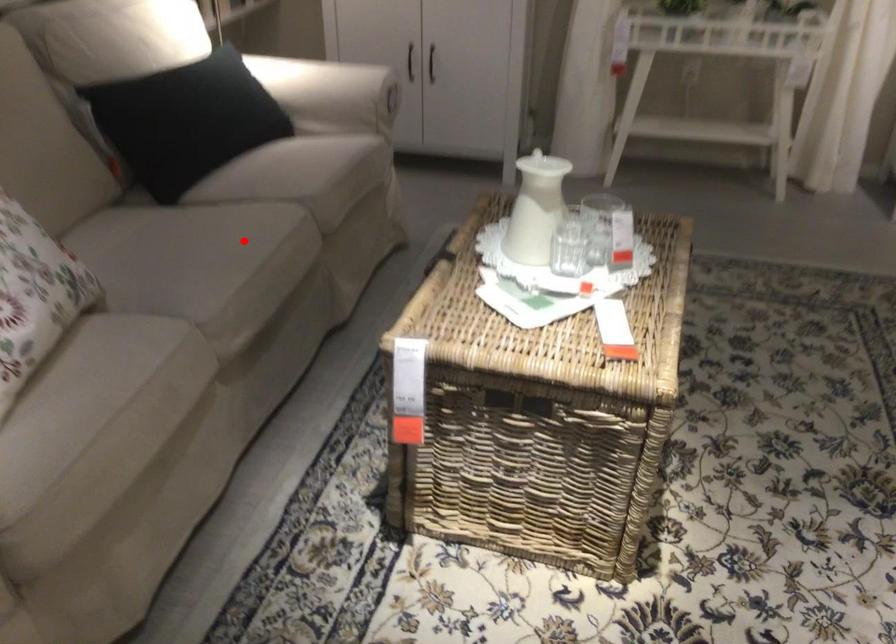
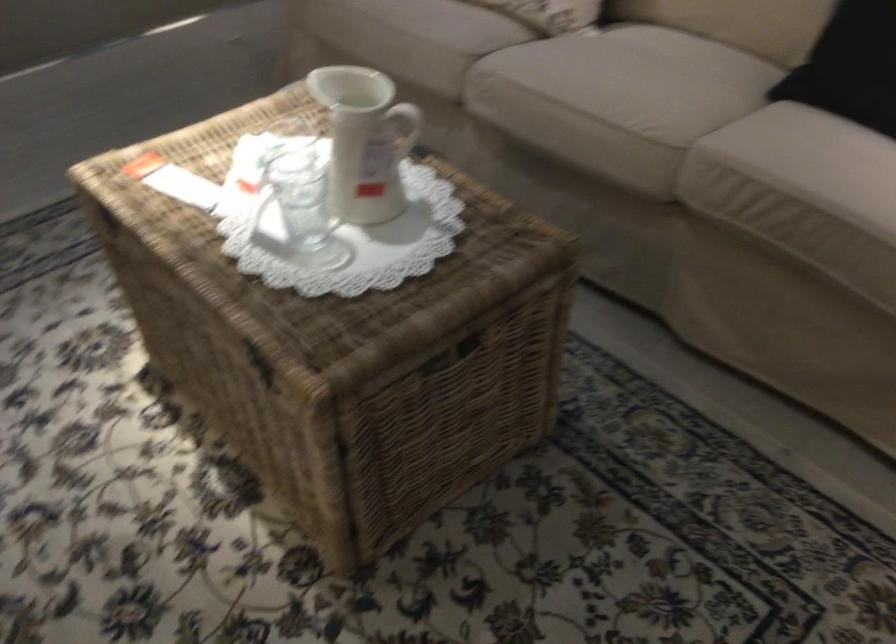
Question: I am providing you with two images of the same scene from different viewpoints. Image1 has a red point marked. In image2, the corresponding 3D location appears at what relative position? Reply with the corresponding letter.

Choices:
 (A) Closer
 (B) Farther

Answer: (A)